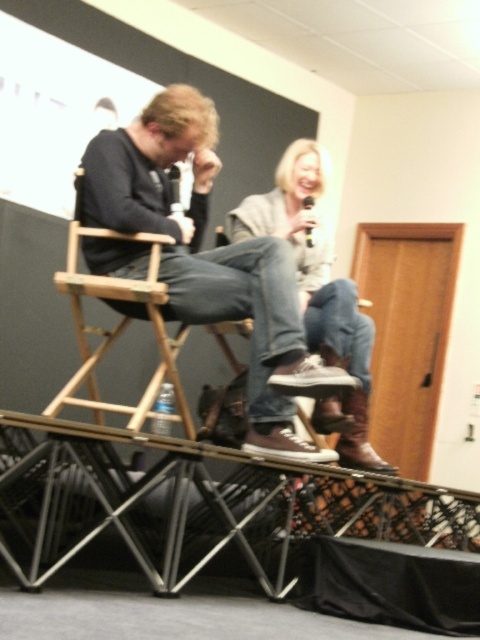
You are designing a stage layout and need to ensure that the footwear and clothing items are spaced appropriately. Given the two items at center stage, the matte black sneakers at center and denim jeans at center, which one requires more floor space due to its size?

The matte black sneakers at center requires more floor space because it has a larger size compared to the denim jeans at center.